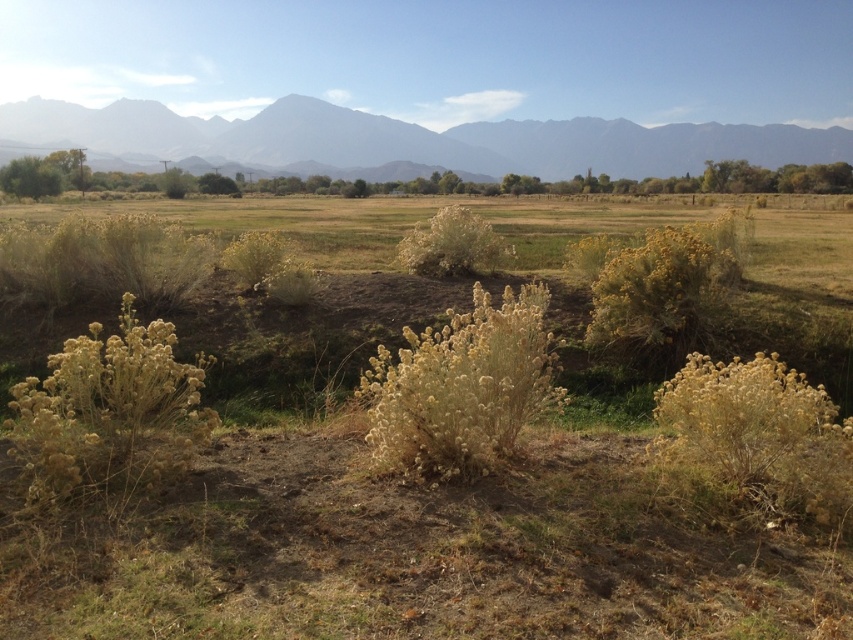
Question: Which point is closer to the camera?

Choices:
 (A) (22, 172)
 (B) (55, 493)
 (C) (532, 404)
 (D) (209, 186)

Answer: (B)

Question: Is fuzzy yellow bush at center bigger than green leafy bush at left?

Choices:
 (A) yes
 (B) no

Answer: (B)

Question: Among these points, which one is farthest from the camera?

Choices:
 (A) (231, 186)
 (B) (53, 186)
 (C) (476, 291)

Answer: (A)

Question: From the image, what is the correct spatial relationship of fuzzy yellow bush at left in relation to fuzzy yellow bush at center?

Choices:
 (A) below
 (B) above

Answer: (A)

Question: Considering the real-world distances, which object is farthest from the green leafy bush at left?

Choices:
 (A) gray rocky mountain range at upper center
 (B) fuzzy yellow bush at left
 (C) fuzzy yellow bush at center

Answer: (C)

Question: Is fuzzy yellow bush at left positioned before yellow fluffy bush at center?

Choices:
 (A) no
 (B) yes

Answer: (B)